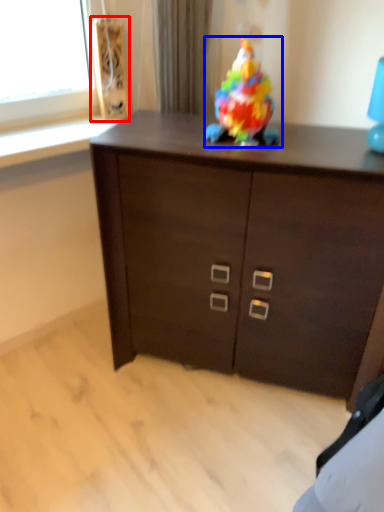
Question: Which object is closer to the camera taking this photo, speaker (highlighted by a red box) or toy (highlighted by a blue box)?

Choices:
 (A) speaker
 (B) toy

Answer: (B)